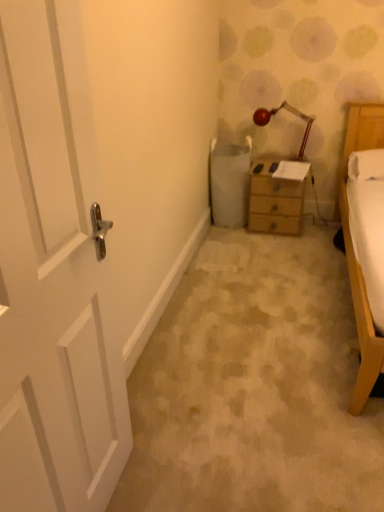
Locate an element on the screen. free point below matte red lamp at upper right (from a real-world perspective) is located at coordinates (267, 162).